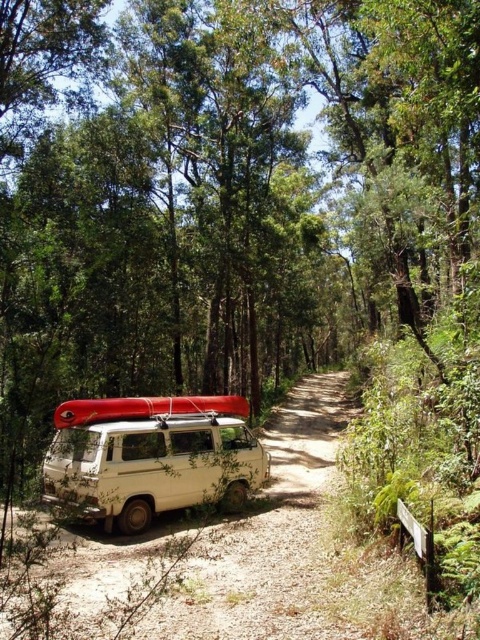
Question: Can you confirm if white matte van at center is positioned above rubberized red canoe at center?

Choices:
 (A) no
 (B) yes

Answer: (A)

Question: Which point appears farthest from the camera in this image?

Choices:
 (A) (104, 488)
 (B) (164, 396)

Answer: (B)

Question: Is white matte van at center below rubberized red canoe at center?

Choices:
 (A) yes
 (B) no

Answer: (A)

Question: Which point appears farthest from the camera in this image?

Choices:
 (A) (62, 419)
 (B) (187, 496)

Answer: (B)

Question: Does white matte van at center lie in front of rubberized red canoe at center?

Choices:
 (A) no
 (B) yes

Answer: (B)